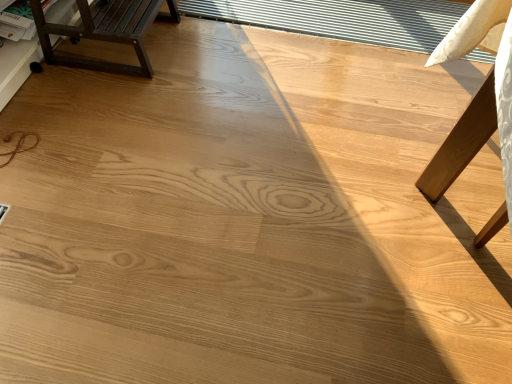
Question: In the image, is matte dark brown wooden bench at upper left on the left side or the right side of transparent plastic window at upper center?

Choices:
 (A) left
 (B) right

Answer: (A)

Question: From a real-world perspective, relative to transparent plastic window at upper center, is matte dark brown wooden bench at upper left vertically above or below?

Choices:
 (A) above
 (B) below

Answer: (A)

Question: Considering the positions of matte dark brown wooden bench at upper left and transparent plastic window at upper center in the image, is matte dark brown wooden bench at upper left bigger or smaller than transparent plastic window at upper center?

Choices:
 (A) small
 (B) big

Answer: (B)

Question: From the image's perspective, relative to matte dark brown wooden bench at upper left, is transparent plastic window at upper center above or below?

Choices:
 (A) above
 (B) below

Answer: (A)

Question: Is transparent plastic window at upper center wider or thinner than matte dark brown wooden bench at upper left?

Choices:
 (A) thin
 (B) wide

Answer: (B)

Question: Is transparent plastic window at upper center bigger or smaller than matte dark brown wooden bench at upper left?

Choices:
 (A) big
 (B) small

Answer: (B)

Question: Is transparent plastic window at upper center inside the boundaries of matte dark brown wooden bench at upper left, or outside?

Choices:
 (A) outside
 (B) inside

Answer: (A)